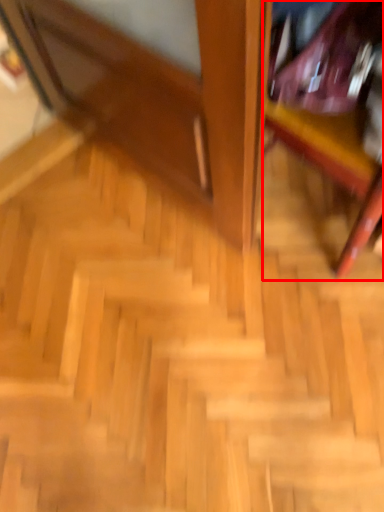
Question: From the image, what is the correct spatial relationship of furniture (annotated by the red box) in relation to stairs?

Choices:
 (A) left
 (B) right

Answer: (B)